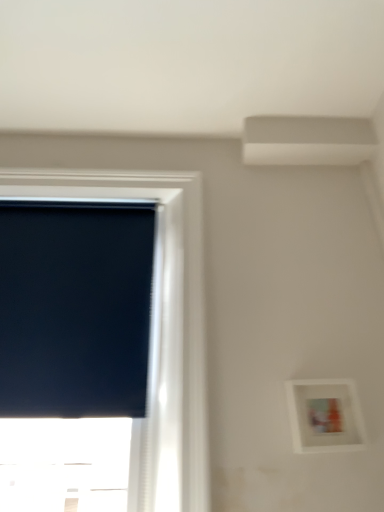
Question: Is the position of black matte window screen at left less distant than that of black matte window at left?

Choices:
 (A) no
 (B) yes

Answer: (A)

Question: Is black matte window screen at left outside black matte window at left?

Choices:
 (A) no
 (B) yes

Answer: (A)

Question: Are black matte window screen at left and black matte window at left far apart?

Choices:
 (A) no
 (B) yes

Answer: (A)

Question: Can you confirm if black matte window screen at left is shorter than black matte window at left?

Choices:
 (A) no
 (B) yes

Answer: (B)

Question: From a real-world perspective, does black matte window screen at left sit lower than black matte window at left?

Choices:
 (A) no
 (B) yes

Answer: (A)

Question: Is white matte picture frame at lower right spatially inside black matte window at left, or outside of it?

Choices:
 (A) inside
 (B) outside

Answer: (B)

Question: Is white matte picture frame at lower right bigger or smaller than black matte window at left?

Choices:
 (A) big
 (B) small

Answer: (B)

Question: Would you say white matte picture frame at lower right is to the left or to the right of black matte window at left in the picture?

Choices:
 (A) left
 (B) right

Answer: (B)

Question: From the image's perspective, is white matte picture frame at lower right above or below black matte window at left?

Choices:
 (A) below
 (B) above

Answer: (A)

Question: From a real-world perspective, is black matte window at left positioned above or below white matte picture frame at lower right?

Choices:
 (A) below
 (B) above

Answer: (B)

Question: Do you think black matte window at left is within white matte picture frame at lower right, or outside of it?

Choices:
 (A) inside
 (B) outside

Answer: (B)

Question: Based on their sizes in the image, would you say black matte window at left is bigger or smaller than white matte picture frame at lower right?

Choices:
 (A) big
 (B) small

Answer: (A)

Question: In terms of height, does black matte window at left look taller or shorter compared to white matte picture frame at lower right?

Choices:
 (A) tall
 (B) short

Answer: (A)

Question: Is black matte window screen at left situated inside white matte picture frame at lower right or outside?

Choices:
 (A) outside
 (B) inside

Answer: (A)

Question: Would you say black matte window screen at left is to the left or to the right of white matte picture frame at lower right in the picture?

Choices:
 (A) right
 (B) left

Answer: (B)